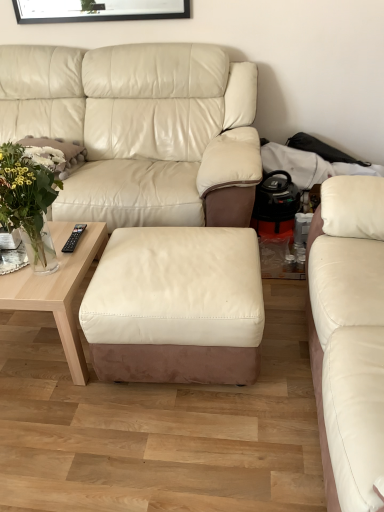
Question: Is matte white leather couch at right, the 2th studio couch from the left, surrounding white fluffy pillow at left?

Choices:
 (A) no
 (B) yes

Answer: (A)

Question: Is matte white leather couch at right, the 2th studio couch from the left, far away from white fluffy pillow at left?

Choices:
 (A) yes
 (B) no

Answer: (A)

Question: Is matte white leather couch at right, the 2th studio couch from the left, located outside white fluffy pillow at left?

Choices:
 (A) yes
 (B) no

Answer: (A)

Question: Is matte white leather couch at right, marked as the first studio couch in a right-to-left arrangement, in contact with white fluffy pillow at left?

Choices:
 (A) no
 (B) yes

Answer: (A)

Question: Does matte white leather couch at right, the 2th studio couch from the left, turn towards white fluffy pillow at left?

Choices:
 (A) no
 (B) yes

Answer: (B)

Question: Is matte white leather couch at right, the 2th studio couch from the left, wider or thinner than light wood coffee table at lower left?

Choices:
 (A) thin
 (B) wide

Answer: (A)

Question: In terms of size, does matte white leather couch at right, the 2th studio couch from the left, appear bigger or smaller than light wood coffee table at lower left?

Choices:
 (A) big
 (B) small

Answer: (A)

Question: Considering the relative positions of matte white leather couch at right, the 2th studio couch from the left, and light wood coffee table at lower left in the image provided, is matte white leather couch at right, the 2th studio couch from the left, to the left or to the right of light wood coffee table at lower left?

Choices:
 (A) left
 (B) right

Answer: (B)

Question: In terms of height, does matte white leather couch at right, marked as the first studio couch in a right-to-left arrangement, look taller or shorter compared to light wood coffee table at lower left?

Choices:
 (A) tall
 (B) short

Answer: (A)

Question: From a real-world perspective, is black matte picture frame at upper center positioned above or below light wood coffee table at lower left?

Choices:
 (A) above
 (B) below

Answer: (A)

Question: In terms of size, does black matte picture frame at upper center appear bigger or smaller than light wood coffee table at lower left?

Choices:
 (A) big
 (B) small

Answer: (B)

Question: Considering the positions of point 167,3 and point 71,270, is point 167,3 closer or farther from the camera than point 71,270?

Choices:
 (A) farther
 (B) closer

Answer: (A)

Question: Is black matte picture frame at upper center situated inside light wood coffee table at lower left or outside?

Choices:
 (A) inside
 (B) outside

Answer: (B)

Question: From the image's perspective, relative to light wood coffee table at lower left, is translucent glass vase at upper left above or below?

Choices:
 (A) above
 (B) below

Answer: (A)

Question: Is translucent glass vase at upper left taller or shorter than light wood coffee table at lower left?

Choices:
 (A) short
 (B) tall

Answer: (B)